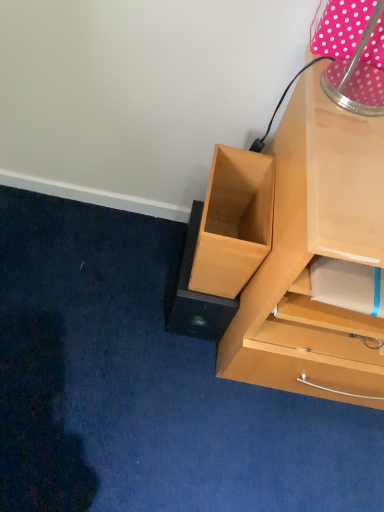
What do you see at coordinates (234, 222) in the screenshot? I see `brown cardboard drawer at lower left` at bounding box center [234, 222].

Find the location of `brown cardboard drawer at lower left`. brown cardboard drawer at lower left is located at coordinates (234, 222).

Identify the location of pink polka dot fabric at upper right. The height and width of the screenshot is (512, 384). (357, 77).

Measure the distance between point [324,10] and camera.

Point [324,10] is 32.72 inches away from camera.

The image size is (384, 512). Describe the element at coordinates (357, 77) in the screenshot. I see `pink polka dot fabric at upper right` at that location.

Identify the location of brown cardboard drawer at lower left. (234, 222).

Considering the relative positions of pink polka dot fabric at upper right and brown cardboard drawer at lower left in the image provided, is pink polka dot fabric at upper right to the right of brown cardboard drawer at lower left from the viewer's perspective?

Indeed, pink polka dot fabric at upper right is positioned on the right side of brown cardboard drawer at lower left.

Is the position of pink polka dot fabric at upper right more distant than that of brown cardboard drawer at lower left?

No, pink polka dot fabric at upper right is in front of brown cardboard drawer at lower left.

Does point (342, 73) come in front of point (252, 237)?

Yes, point (342, 73) is closer to viewer.

From the image's perspective, is pink polka dot fabric at upper right above or below brown cardboard drawer at lower left?

Based on their image positions, pink polka dot fabric at upper right is located above brown cardboard drawer at lower left.

From a real-world perspective, is pink polka dot fabric at upper right positioned above or below brown cardboard drawer at lower left?

From a real-world perspective, pink polka dot fabric at upper right is physically above brown cardboard drawer at lower left.

Consider the image. Is pink polka dot fabric at upper right wider than brown cardboard drawer at lower left?

In fact, pink polka dot fabric at upper right might be narrower than brown cardboard drawer at lower left.

Considering the relative sizes of pink polka dot fabric at upper right and brown cardboard drawer at lower left in the image provided, is pink polka dot fabric at upper right taller than brown cardboard drawer at lower left?

In fact, pink polka dot fabric at upper right may be shorter than brown cardboard drawer at lower left.

Can you confirm if pink polka dot fabric at upper right is smaller than brown cardboard drawer at lower left?

Yes.

Based on the photo, is brown cardboard drawer at lower left inside pink polka dot fabric at upper right?

Actually, brown cardboard drawer at lower left is outside pink polka dot fabric at upper right.

Are pink polka dot fabric at upper right and brown cardboard drawer at lower left making contact?

No, pink polka dot fabric at upper right is not touching brown cardboard drawer at lower left.

Is pink polka dot fabric at upper right turned away from brown cardboard drawer at lower left?

No, pink polka dot fabric at upper right's orientation is not away from brown cardboard drawer at lower left.

How different are the orientations of pink polka dot fabric at upper right and brown cardboard drawer at lower left in degrees?

1.61 degrees.

Identify the location of table lamp above the brown cardboard drawer at lower left (from the image's perspective). (357, 77).

Can you confirm if brown cardboard drawer at lower left is positioned to the right of pink polka dot fabric at upper right?

No.

Which object is more forward, brown cardboard drawer at lower left or pink polka dot fabric at upper right?

pink polka dot fabric at upper right.

Which is closer, (220, 232) or (382, 1)?

Positioned in front is point (382, 1).

From the image's perspective, is brown cardboard drawer at lower left located beneath pink polka dot fabric at upper right?

Yes, from the image's perspective, brown cardboard drawer at lower left is below pink polka dot fabric at upper right.

From a real-world perspective, is brown cardboard drawer at lower left positioned under pink polka dot fabric at upper right based on gravity?

Yes.

Between brown cardboard drawer at lower left and pink polka dot fabric at upper right, which one has larger width?

brown cardboard drawer at lower left.

Considering the sizes of objects brown cardboard drawer at lower left and pink polka dot fabric at upper right in the image provided, who is shorter, brown cardboard drawer at lower left or pink polka dot fabric at upper right?

With less height is pink polka dot fabric at upper right.

Considering the sizes of objects brown cardboard drawer at lower left and pink polka dot fabric at upper right in the image provided, who is bigger, brown cardboard drawer at lower left or pink polka dot fabric at upper right?

With larger size is brown cardboard drawer at lower left.

Is brown cardboard drawer at lower left surrounding pink polka dot fabric at upper right?

That's incorrect, pink polka dot fabric at upper right is not inside brown cardboard drawer at lower left.

Is brown cardboard drawer at lower left placed right next to pink polka dot fabric at upper right?

They are not placed beside each other.

Is brown cardboard drawer at lower left turned away from pink polka dot fabric at upper right?

No.

The height and width of the screenshot is (512, 384). What are the coordinates of `drawer behind the pink polka dot fabric at upper right` in the screenshot? It's located at (234, 222).

At what (x,y) coordinates should I click in order to perform the action: click on table lamp that is on the right side of brown cardboard drawer at lower left. Please return your answer as a coordinate pair (x, y). Looking at the image, I should click on (357, 77).

Identify the location of table lamp above the brown cardboard drawer at lower left (from a real-world perspective). This screenshot has width=384, height=512. (357, 77).